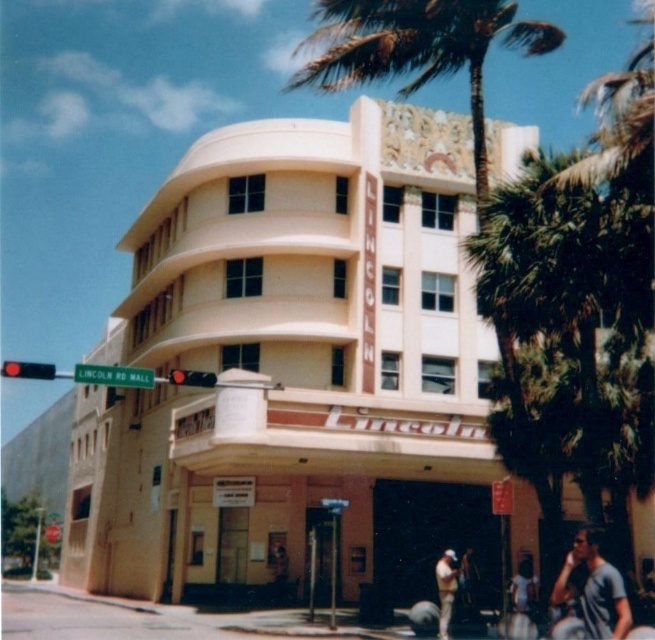
Question: Does gray cotton t-shirt at lower right appear under tan leather jacket at lower center?

Choices:
 (A) no
 (B) yes

Answer: (A)

Question: Where is gray cotton t-shirt at lower right located in relation to green metal street sign at upper center in the image?

Choices:
 (A) right
 (B) left

Answer: (A)

Question: Which point appears farthest from the camera in this image?

Choices:
 (A) (457, 566)
 (B) (441, 435)
 (C) (119, 380)
 (D) (517, 566)

Answer: (D)

Question: Which of the following is the farthest from the observer?

Choices:
 (A) (81, 372)
 (B) (238, 224)
 (C) (569, 586)

Answer: (B)

Question: Which of the following is the farthest from the observer?

Choices:
 (A) (578, 600)
 (B) (136, 564)
 (C) (517, 595)
 (D) (438, 582)

Answer: (B)

Question: Does light blue jeans at lower right appear on the right side of tan leather jacket at lower center?

Choices:
 (A) no
 (B) yes

Answer: (B)